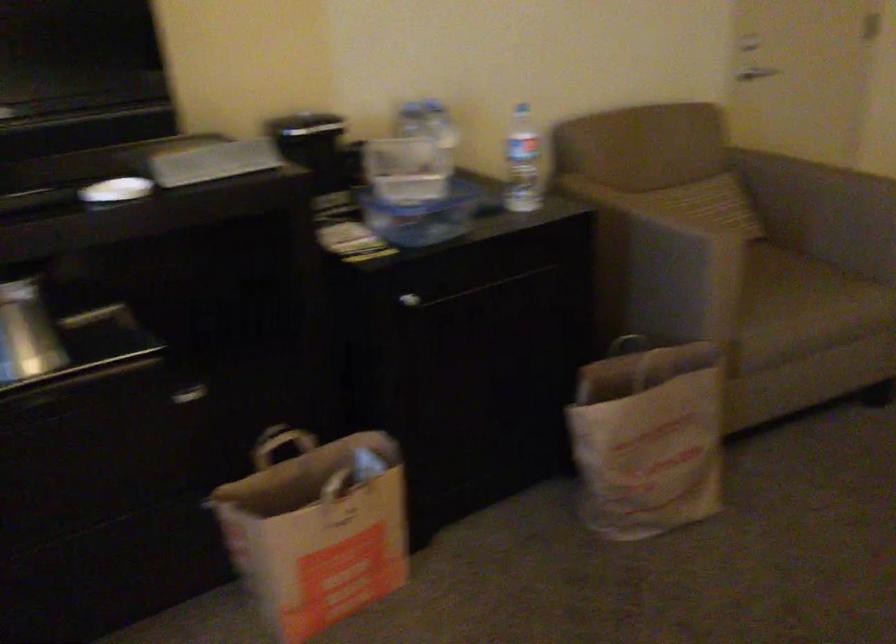
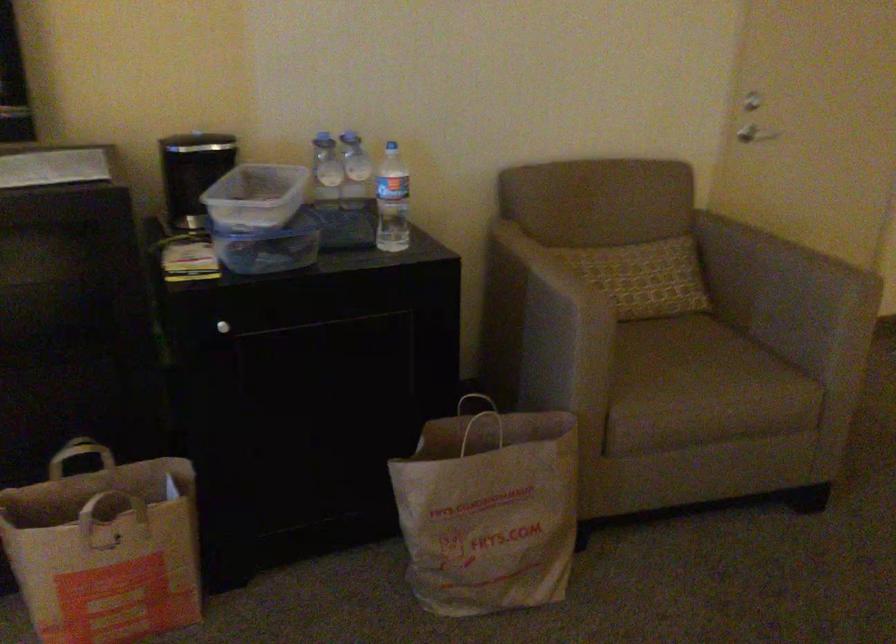
The point at (385, 171) is marked in the first image. Where is the corresponding point in the second image?

(255, 196)